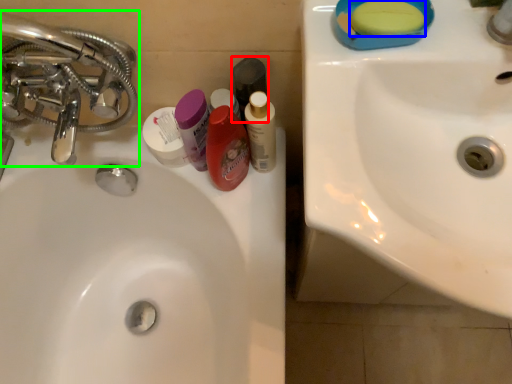
Question: Estimate the real-world distances between objects in this image. Which object is farther from mouthwash (highlighted by a red box), soap (highlighted by a blue box) or tap (highlighted by a green box)?

Choices:
 (A) soap
 (B) tap

Answer: (B)